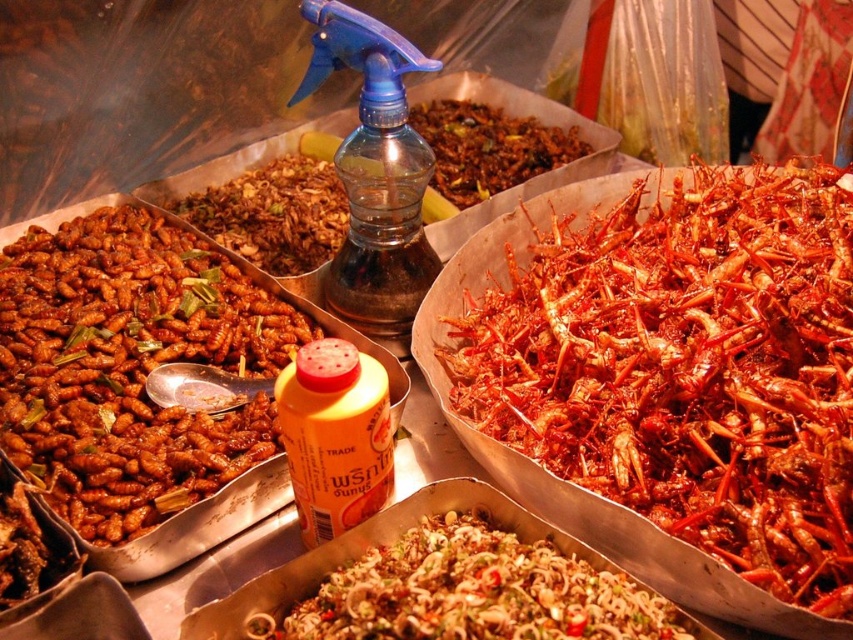
Question: Which of the following is the closest to the observer?

Choices:
 (A) (367, 580)
 (B) (36, 237)

Answer: (A)

Question: From the image, what is the correct spatial relationship of red crunchy insects at center in relation to brown crispy insects at center?

Choices:
 (A) above
 (B) below

Answer: (B)

Question: Which point is closer to the camera taking this photo?

Choices:
 (A) (378, 467)
 (B) (717, 502)

Answer: (B)

Question: Considering the relative positions of red crunchy insects at center and brown matte insects at left in the image provided, where is red crunchy insects at center located with respect to brown matte insects at left?

Choices:
 (A) below
 (B) above

Answer: (A)

Question: Which point is farther to the camera?

Choices:
 (A) red crunchy insects at center
 (B) yellow plastic bottle at center
 (C) brown matte insects at left

Answer: (C)

Question: Can you confirm if brown matte insects at left is bigger than yellow plastic bottle at center?

Choices:
 (A) no
 (B) yes

Answer: (B)